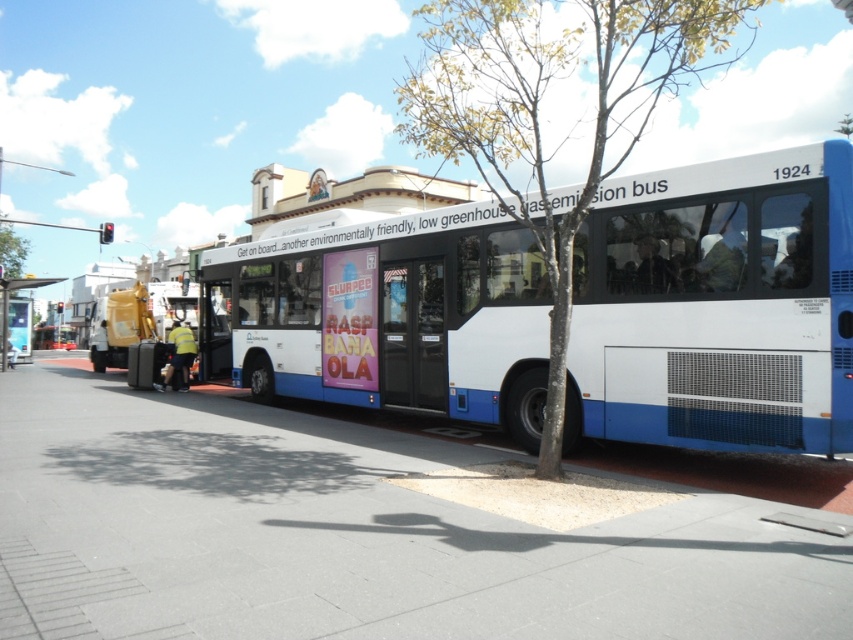
Is gray concrete pavement at center behind white matte bus at center?

No, it is in front of white matte bus at center.

What do you see at coordinates (352, 536) in the screenshot?
I see `gray concrete pavement at center` at bounding box center [352, 536].

The height and width of the screenshot is (640, 853). Describe the element at coordinates (352, 536) in the screenshot. I see `gray concrete pavement at center` at that location.

The height and width of the screenshot is (640, 853). I want to click on gray concrete pavement at center, so click(352, 536).

Does white matte bus at center have a lesser width compared to metallic bus stop at left?

Indeed, white matte bus at center has a lesser width compared to metallic bus stop at left.

Can you confirm if white matte bus at center is taller than metallic bus stop at left?

No.

The height and width of the screenshot is (640, 853). Find the location of `white matte bus at center`. white matte bus at center is located at coordinates (717, 307).

Which is behind, point (589, 595) or point (558, 257)?

The point (558, 257) is behind.

Who is lower down, gray concrete pavement at center or green leafy tree at center?

Positioned lower is gray concrete pavement at center.

Find the location of a particular element. gray concrete pavement at center is located at coordinates (352, 536).